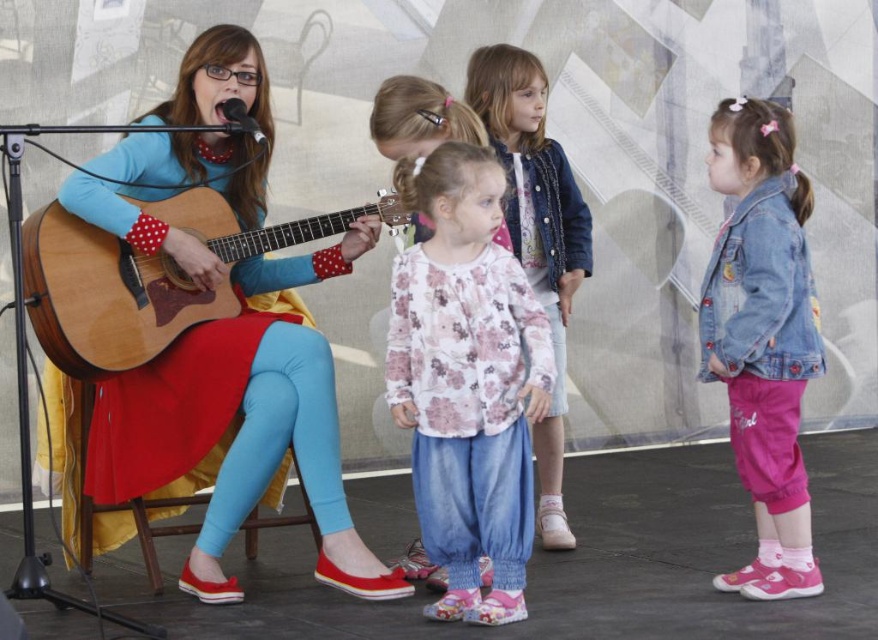
Question: Observing the image, what is the correct spatial positioning of matte wood guitar at left in reference to denim jacket at lower right?

Choices:
 (A) left
 (B) right

Answer: (A)

Question: Can you confirm if matte wood guitar at left is smaller than floral fabric shirt at center?

Choices:
 (A) yes
 (B) no

Answer: (B)

Question: Which is farther from the floral fabric shirt at center?

Choices:
 (A) floral cotton shirt at center
 (B) denim jacket at lower right
 (C) matte wood guitar at left

Answer: (C)

Question: Does wooden acoustic guitar at left appear under floral fabric shirt at center?

Choices:
 (A) no
 (B) yes

Answer: (A)

Question: Among these objects, which one is nearest to the camera?

Choices:
 (A) matte wood guitar at left
 (B) floral fabric shirt at center

Answer: (A)

Question: Which point is farther to the camera?

Choices:
 (A) wooden acoustic guitar at left
 (B) matte wood guitar at left

Answer: (B)